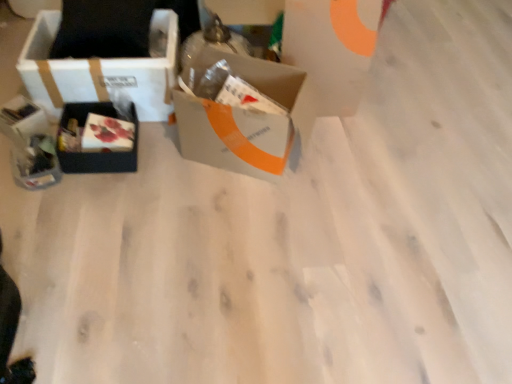
Identify the location of space that is in front of matte plastic box at center-left. This screenshot has height=384, width=512. (103, 190).